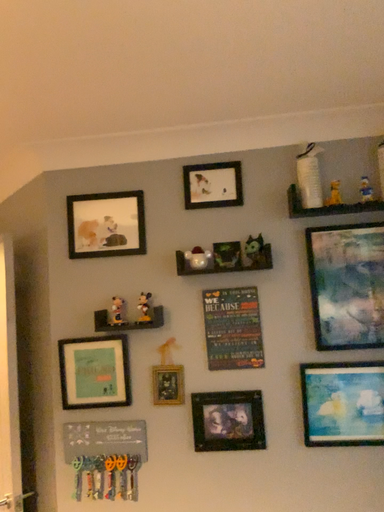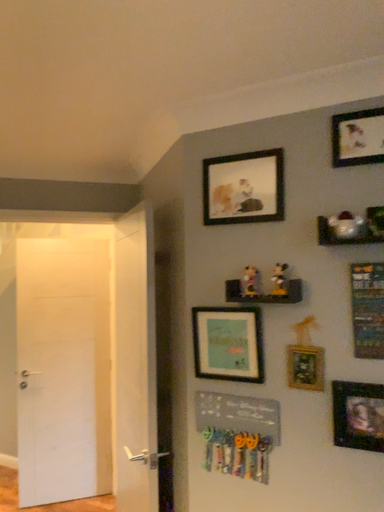
Question: Which way did the camera rotate in the video?

Choices:
 (A) rotated right
 (B) rotated left

Answer: (B)